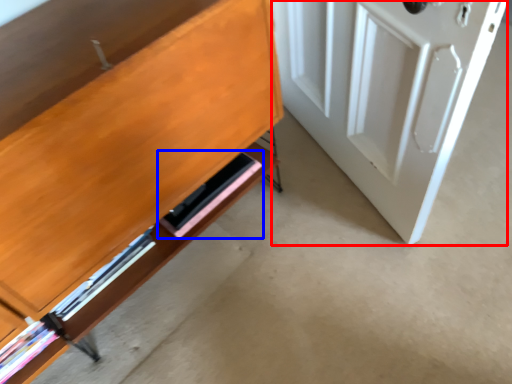
Question: Which of the following is the closest to the observer, door (highlighted by a red box) or shelf (highlighted by a blue box)?

Choices:
 (A) door
 (B) shelf

Answer: (A)